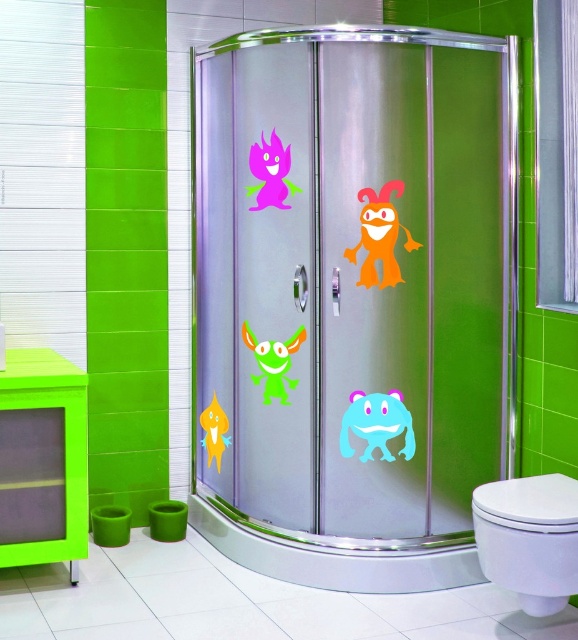
Question: Does white glossy toilet bowl at lower right lie in front of pink glossy monster at upper center?

Choices:
 (A) no
 (B) yes

Answer: (B)

Question: Based on their relative distances, which object is nearer to the white glossy toilet bowl at lower right?

Choices:
 (A) transparent glass shower door at center
 (B) yellow matte fish at lower center
 (C) translucent plastic monster at center
 (D) green glossy alien at center

Answer: (C)

Question: Which point is farther from the camera taking this photo?

Choices:
 (A) (523, 586)
 (B) (250, 208)
 (C) (221, 440)
 (D) (372, 436)

Answer: (C)

Question: Can you confirm if orange matte sticker at upper right is positioned below pink glossy monster at upper center?

Choices:
 (A) no
 (B) yes

Answer: (B)

Question: Which of the following is the farthest from the observer?

Choices:
 (A) (216, 454)
 (B) (524, 532)
 (C) (350, 394)

Answer: (A)

Question: Can you confirm if translucent plastic monster at center is smaller than yellow matte fish at lower center?

Choices:
 (A) no
 (B) yes

Answer: (B)